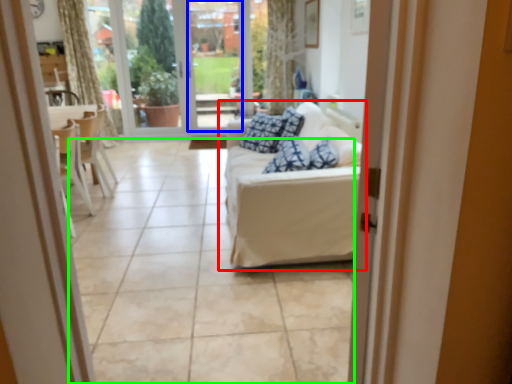
Question: Based on their relative distances, which object is nearer to studio couch (highlighted by a red box)? Choose from window screen (highlighted by a blue box) and tile (highlighted by a green box).

Choices:
 (A) window screen
 (B) tile

Answer: (B)